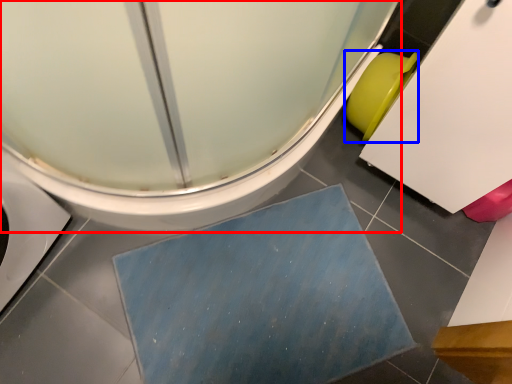
Question: Which point is further to the camera, toilet (highlighted by a red box) or toilet bowl (highlighted by a blue box)?

Choices:
 (A) toilet
 (B) toilet bowl

Answer: (B)